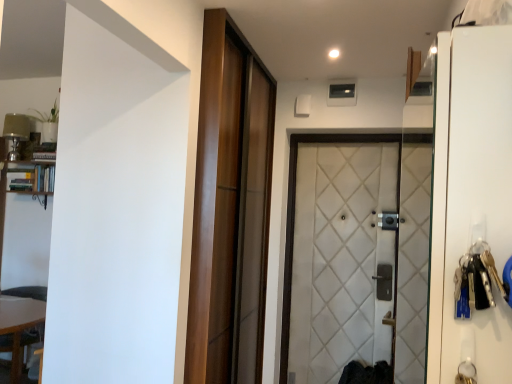
This screenshot has height=384, width=512. Find the location of `white glossy screen door at right`. white glossy screen door at right is located at coordinates (471, 193).

What do you see at coordinates (19, 325) in the screenshot? I see `wooden table at lower left` at bounding box center [19, 325].

Describe the element at coordinates (229, 213) in the screenshot. I see `wooden sliding door at center, the first door positioned from the left` at that location.

At what (x,y) coordinates should I click in order to perform the action: click on white glossy screen door at right. Please return your answer as a coordinate pair (x, y). The width and height of the screenshot is (512, 384). Looking at the image, I should click on (471, 193).

Would you say wooden bookshelf at left is outside white glossy screen door at right?

That's correct, wooden bookshelf at left is outside of white glossy screen door at right.

Between wooden bookshelf at left and white glossy screen door at right, which one has larger size?

With larger size is white glossy screen door at right.

Between wooden bookshelf at left and white glossy screen door at right, which one has larger width?

Wider between the two is white glossy screen door at right.

Measure the distance from wooden bookshelf at left to white glossy screen door at right.

wooden bookshelf at left is 3.41 meters away from white glossy screen door at right.

Considering the points (41, 303) and (505, 143), which point is in front, point (41, 303) or point (505, 143)?

The point (505, 143) is closer.

Can you confirm if wooden table at lower left is shorter than white glossy screen door at right?

Indeed, wooden table at lower left has a lesser height compared to white glossy screen door at right.

Considering the relative sizes of wooden table at lower left and white glossy screen door at right in the image provided, is wooden table at lower left bigger than white glossy screen door at right?

Yes, wooden table at lower left is bigger than white glossy screen door at right.

Locate an element on the screen. The width and height of the screenshot is (512, 384). table on the left of white glossy screen door at right is located at coordinates click(x=19, y=325).

Can you confirm if white glossy screen door at right is bigger than wooden bookshelf at left?

Indeed, white glossy screen door at right has a larger size compared to wooden bookshelf at left.

Consider the image. From the image's perspective, who appears lower, white glossy screen door at right or wooden bookshelf at left?

white glossy screen door at right.

Is white glossy screen door at right positioned behind wooden bookshelf at left?

No, white glossy screen door at right is closer to the viewer.

From a real-world perspective, which is physically above, wooden sliding door at center, the first door positioned from the left, or white glossy screen door at right?

white glossy screen door at right, from a real-world perspective.

Is wooden sliding door at center, the first door positioned from the left, oriented away from white glossy screen door at right?

wooden sliding door at center, the first door positioned from the left, is not turned away from white glossy screen door at right.

Consider the image. Could white glossy screen door at right be considered to be inside wooden sliding door at center, the first door positioned from the left?

Actually, white glossy screen door at right is outside wooden sliding door at center, the first door positioned from the left.

Which is nearer, (255, 223) or (462, 251)?

Point (255, 223) appears to be farther away from the viewer than point (462, 251).

Does point (234, 70) come closer to viewer compared to point (24, 179)?

Yes, it is.

Is wooden sliding door at center, arranged as the 2th door when viewed from the right, placed right next to wooden bookshelf at left?

They are not placed beside each other.

Is wooden bookshelf at left at the back of wooden sliding door at center, arranged as the 2th door when viewed from the right?

Yes, wooden sliding door at center, arranged as the 2th door when viewed from the right, is positioned with its back facing wooden bookshelf at left.

What's the angular difference between wooden sliding door at center, the first door positioned from the left, and wooden bookshelf at left's facing directions?

The angle between the facing direction of wooden sliding door at center, the first door positioned from the left, and the facing direction of wooden bookshelf at left is 92 degrees.

Which point is more distant from viewer, (301, 134) or (509, 152)?

The point (301, 134) is farther from the camera.

How far apart are white quilted fabric door at center, arranged as the 2th door when viewed from the left, and white glossy screen door at right?

The distance of white quilted fabric door at center, arranged as the 2th door when viewed from the left, from white glossy screen door at right is 2.38 meters.

From a real-world perspective, is white quilted fabric door at center, arranged as the 2th door when viewed from the left, located beneath white glossy screen door at right?

Indeed, from a real-world perspective, white quilted fabric door at center, arranged as the 2th door when viewed from the left, is positioned beneath white glossy screen door at right.

The width and height of the screenshot is (512, 384). I want to click on screen door above the white quilted fabric door at center, arranged as the 2th door when viewed from the left (from a real-world perspective), so click(471, 193).

How different are the orientations of white glossy screen door at right and wooden sliding door at center, arranged as the 2th door when viewed from the right, in degrees?

They differ by 180 degrees in their facing directions.

In the scene shown: How far apart are white glossy screen door at right and wooden sliding door at center, the first door positioned from the left?

white glossy screen door at right is 1.64 meters from wooden sliding door at center, the first door positioned from the left.

Is white glossy screen door at right not near wooden sliding door at center, arranged as the 2th door when viewed from the right?

Yes, white glossy screen door at right is far from wooden sliding door at center, arranged as the 2th door when viewed from the right.

Is white glossy screen door at right oriented away from wooden sliding door at center, the first door positioned from the left?

No, white glossy screen door at right's orientation is not away from wooden sliding door at center, the first door positioned from the left.

Image resolution: width=512 pixels, height=384 pixels. Identify the location of screen door below the wooden bookshelf at left (from the image's perspective). (471, 193).

Image resolution: width=512 pixels, height=384 pixels. I want to click on screen door above the wooden table at lower left (from the image's perspective), so click(x=471, y=193).

Considering their positions, is white glossy screen door at right positioned further to wooden table at lower left than wooden bookshelf at left?

white glossy screen door at right lies further to wooden table at lower left than the other object.

From the image, which object appears to be nearer to white glossy screen door at right, wooden sliding door at center, arranged as the 2th door when viewed from the right, or wooden table at lower left?

wooden sliding door at center, arranged as the 2th door when viewed from the right, is closer to white glossy screen door at right.

Looking at this image, estimate the real-world distances between objects in this image. Which object is further from white glossy screen door at right, wooden sliding door at center, arranged as the 2th door when viewed from the right, or white quilted fabric door at center, arranged as the 2th door when viewed from the left?

white quilted fabric door at center, arranged as the 2th door when viewed from the left, lies further to white glossy screen door at right than the other object.

When comparing their distances from wooden sliding door at center, arranged as the 2th door when viewed from the right, does white glossy screen door at right or white quilted fabric door at center, the 1th door viewed from the right, seem further?

white glossy screen door at right is further to wooden sliding door at center, arranged as the 2th door when viewed from the right.

Estimate the real-world distances between objects in this image. Which object is closer to white glossy screen door at right, wooden sliding door at center, arranged as the 2th door when viewed from the right, or wooden bookshelf at left?

wooden sliding door at center, arranged as the 2th door when viewed from the right, is positioned closer to the anchor white glossy screen door at right.

When comparing their distances from wooden sliding door at center, the first door positioned from the left, does white quilted fabric door at center, arranged as the 2th door when viewed from the left, or wooden table at lower left seem further?

wooden table at lower left is positioned further to the anchor wooden sliding door at center, the first door positioned from the left.

Which object lies further to the anchor point wooden sliding door at center, the first door positioned from the left, white quilted fabric door at center, arranged as the 2th door when viewed from the left, or wooden bookshelf at left?

Among the two, wooden bookshelf at left is located further to wooden sliding door at center, the first door positioned from the left.

Estimate the real-world distances between objects in this image. Which object is closer to wooden bookshelf at left, wooden table at lower left or wooden sliding door at center, the first door positioned from the left?

wooden table at lower left is positioned closer to the anchor wooden bookshelf at left.

In order to click on table between white glossy screen door at right and wooden bookshelf at left in the front-back direction in this screenshot , I will do `click(19, 325)`.

You are a GUI agent. You are given a task and a screenshot of the screen. Output one action in this format:
    pyautogui.click(x=<x>, y=<y>)
    Task: Click on the door between wooden table at lower left and white glossy screen door at right in the horizontal direction
    The height and width of the screenshot is (384, 512).
    Given the screenshot: What is the action you would take?
    pyautogui.click(x=229, y=213)

The image size is (512, 384). What are the coordinates of `door situated between wooden bookshelf at left and white quilted fabric door at center, the 1th door viewed from the right, from left to right` in the screenshot? It's located at (229, 213).

The height and width of the screenshot is (384, 512). I want to click on table located between wooden bookshelf at left and white quilted fabric door at center, arranged as the 2th door when viewed from the left, in the left-right direction, so click(19, 325).